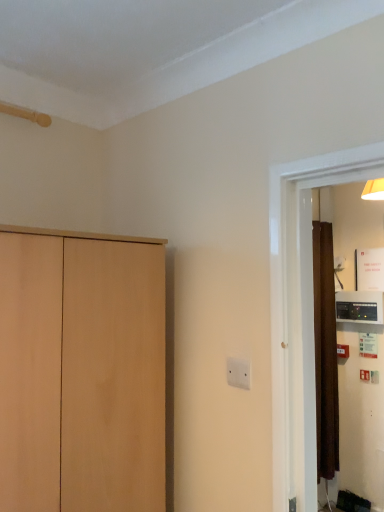
Identify the location of light wood cupboard at left. This screenshot has width=384, height=512. (81, 372).

The image size is (384, 512). Describe the element at coordinates (359, 307) in the screenshot. I see `black plastic thermostat at right` at that location.

Where is `white plastic electric outlet at center`? Image resolution: width=384 pixels, height=512 pixels. white plastic electric outlet at center is located at coordinates (238, 373).

Would you say white plastic electric outlet at center is inside or outside light wood cupboard at left?

The correct answer is: outside.

Could you tell me if white plastic electric outlet at center is facing light wood cupboard at left?

No, white plastic electric outlet at center is not oriented towards light wood cupboard at left.

How many degrees apart are the facing directions of white plastic electric outlet at center and light wood cupboard at left?

There is a 93-degree angle between the facing directions of white plastic electric outlet at center and light wood cupboard at left.

I want to click on cupboard that appears below the white plastic electric outlet at center (from a real-world perspective), so click(81, 372).

Between light wood cupboard at left and white plastic electric outlet at center, which one has less height?

white plastic electric outlet at center is shorter.

Based on the photo, which is less distant, (126, 327) or (242, 362)?

The point (126, 327) is more forward.

Is light wood cupboard at left beside white plastic electric outlet at center?

No.

Considering the sizes of black plastic thermostat at right and white plastic electric outlet at center in the image, is black plastic thermostat at right taller or shorter than white plastic electric outlet at center?

black plastic thermostat at right is taller than white plastic electric outlet at center.

Which object is further away from the camera taking this photo, black plastic thermostat at right or white plastic electric outlet at center?

Positioned behind is black plastic thermostat at right.

Is light wood cupboard at left oriented towards black plastic thermostat at right?

No.

Considering the relative sizes of light wood cupboard at left and black plastic thermostat at right in the image provided, is light wood cupboard at left smaller than black plastic thermostat at right?

No.

Between light wood cupboard at left and black plastic thermostat at right, which one has more height?

light wood cupboard at left is taller.

Is black plastic thermostat at right to the left or to the right of light wood cupboard at left in the image?

In the image, black plastic thermostat at right appears on the right side of light wood cupboard at left.

Is black plastic thermostat at right in contact with light wood cupboard at left?

No, black plastic thermostat at right is not with light wood cupboard at left.

Does point (350, 292) appear closer or farther from the camera than point (124, 469)?

Point (350, 292).

Between black plastic thermostat at right and light wood cupboard at left, which one is positioned behind?

black plastic thermostat at right is further from the camera.

What's the angular difference between white plastic electric outlet at center and black plastic thermostat at right's facing directions?

The angle between the facing direction of white plastic electric outlet at center and the facing direction of black plastic thermostat at right is 0.349 degrees.

From the image's perspective, between white plastic electric outlet at center and black plastic thermostat at right, who is located below?

black plastic thermostat at right, from the image's perspective.

Is white plastic electric outlet at center with black plastic thermostat at right?

No, white plastic electric outlet at center is not making contact with black plastic thermostat at right.

Consider the image. Who is shorter, white plastic electric outlet at center or black plastic thermostat at right?

white plastic electric outlet at center is shorter.

At what (x,y) coordinates should I click in order to perform the action: click on electric outlet above the light wood cupboard at left (from a real-world perspective). Please return your answer as a coordinate pair (x, y). The width and height of the screenshot is (384, 512). Looking at the image, I should click on (238, 373).

The height and width of the screenshot is (512, 384). I want to click on cupboard that appears on the left of white plastic electric outlet at center, so click(x=81, y=372).

Based on their spatial positions, is black plastic thermostat at right or light wood cupboard at left closer to white plastic electric outlet at center?

light wood cupboard at left is closer to white plastic electric outlet at center.

Looking at the image, which one is located further to light wood cupboard at left, black plastic thermostat at right or white plastic electric outlet at center?

black plastic thermostat at right lies further to light wood cupboard at left than the other object.

When comparing their distances from black plastic thermostat at right, does white plastic electric outlet at center or light wood cupboard at left seem further?

Among the two, light wood cupboard at left is located further to black plastic thermostat at right.

In the scene shown: When comparing their distances from white plastic electric outlet at center, does light wood cupboard at left or black plastic thermostat at right seem further?

black plastic thermostat at right is further to white plastic electric outlet at center.

When comparing their distances from black plastic thermostat at right, does light wood cupboard at left or white plastic electric outlet at center seem closer?

white plastic electric outlet at center.

Considering their positions, is white plastic electric outlet at center positioned closer to light wood cupboard at left than black plastic thermostat at right?

The object closer to light wood cupboard at left is white plastic electric outlet at center.

Where is `electric outlet between light wood cupboard at left and black plastic thermostat at right along the z-axis`? electric outlet between light wood cupboard at left and black plastic thermostat at right along the z-axis is located at coordinates (238, 373).